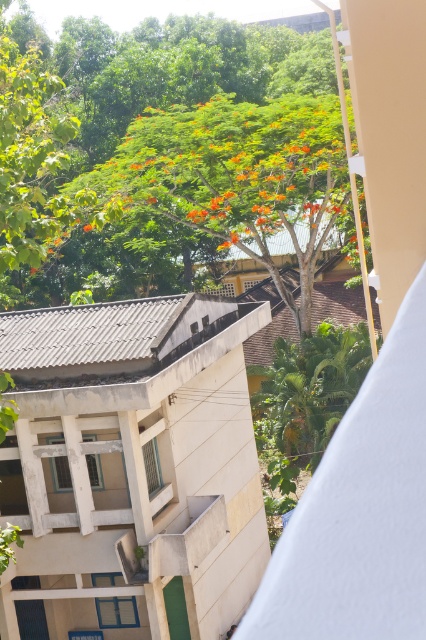
You are standing on the white concrete balcony at center and want to see the green leafy tree at upper center. Can you see it clearly from your current position?

The green leafy tree at upper center is behind the white concrete balcony at center, so you cannot see it clearly from your current position on the white concrete balcony at center.

You are standing on the white concrete balcony at center and want to see the top of the green leafy tree at upper center. Can you see the top of the tree from your current position?

The white concrete balcony at center is shorter than the green leafy tree at upper center, so you cannot see the top of the tree from your current position because the balcony is shorter than the tree.